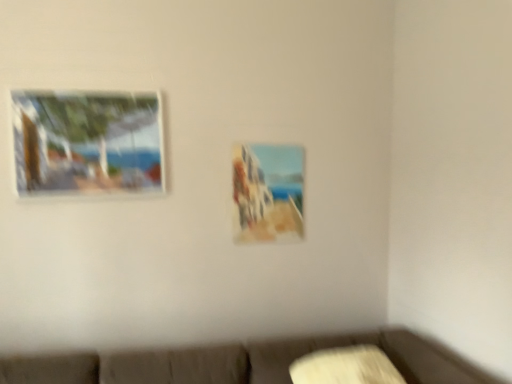
Question: Which direction should I rotate to look at matte glass painting at center, which is counted as the 2th picture frame, starting from the front, — up or down?

Choices:
 (A) down
 (B) up

Answer: (A)

Question: Does matte glass painting at center, which is counted as the 2th picture frame, starting from the front, have a greater width compared to matte wooden picture frame at upper left, arranged as the second picture frame when viewed from the back?

Choices:
 (A) no
 (B) yes

Answer: (A)

Question: Can we say matte glass painting at center, marked as the 1th picture frame in a back-to-front arrangement, lies outside matte wooden picture frame at upper left, the 1th picture frame when ordered from front to back?

Choices:
 (A) no
 (B) yes

Answer: (B)

Question: Is the depth of matte glass painting at center, which is counted as the 2th picture frame, starting from the front, greater than that of matte wooden picture frame at upper left, arranged as the second picture frame when viewed from the back?

Choices:
 (A) yes
 (B) no

Answer: (A)

Question: Is matte glass painting at center, which is counted as the 2th picture frame, starting from the front, next to matte wooden picture frame at upper left, the 1th picture frame when ordered from front to back, and touching it?

Choices:
 (A) yes
 (B) no

Answer: (B)

Question: Is matte glass painting at center, which is counted as the 2th picture frame, starting from the left, thinner than matte wooden picture frame at upper left, arranged as the second picture frame when viewed from the back?

Choices:
 (A) yes
 (B) no

Answer: (A)

Question: From a real-world perspective, is matte glass painting at center, the first picture frame when ordered from right to left, located higher than matte wooden picture frame at upper left, the 1th picture frame when ordered from front to back?

Choices:
 (A) no
 (B) yes

Answer: (A)

Question: From the image's perspective, does matte wooden picture frame at upper left, marked as the 1th picture frame in a left-to-right arrangement, appear lower than matte glass painting at center, which is counted as the 2th picture frame, starting from the front?

Choices:
 (A) yes
 (B) no

Answer: (B)

Question: Does matte wooden picture frame at upper left, marked as the 1th picture frame in a left-to-right arrangement, contain matte glass painting at center, which is counted as the 2th picture frame, starting from the front?

Choices:
 (A) no
 (B) yes

Answer: (A)

Question: Can you confirm if matte wooden picture frame at upper left, the 1th picture frame when ordered from front to back, is positioned to the right of matte glass painting at center, which is counted as the 2th picture frame, starting from the left?

Choices:
 (A) no
 (B) yes

Answer: (A)

Question: Does matte wooden picture frame at upper left, the 1th picture frame when ordered from front to back, have a smaller size compared to matte glass painting at center, which is counted as the 2th picture frame, starting from the left?

Choices:
 (A) no
 (B) yes

Answer: (A)

Question: Is matte wooden picture frame at upper left, the 1th picture frame when ordered from front to back, with matte glass painting at center, which is counted as the 2th picture frame, starting from the left?

Choices:
 (A) no
 (B) yes

Answer: (A)

Question: Does matte wooden picture frame at upper left, marked as the 1th picture frame in a left-to-right arrangement, lie behind matte glass painting at center, which is counted as the 2th picture frame, starting from the left?

Choices:
 (A) no
 (B) yes

Answer: (A)

Question: In terms of width, does matte wooden picture frame at upper left, arranged as the second picture frame when viewed from the back, look wider or thinner when compared to matte glass painting at center, the first picture frame when ordered from right to left?

Choices:
 (A) wide
 (B) thin

Answer: (A)